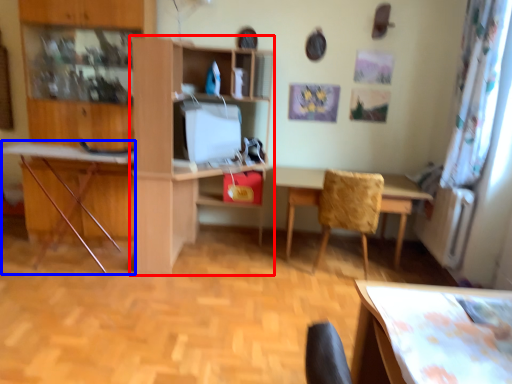
Question: Which of the following is the closest to the observer, shelf (highlighted by a red box) or computer desk (highlighted by a blue box)?

Choices:
 (A) shelf
 (B) computer desk

Answer: (A)